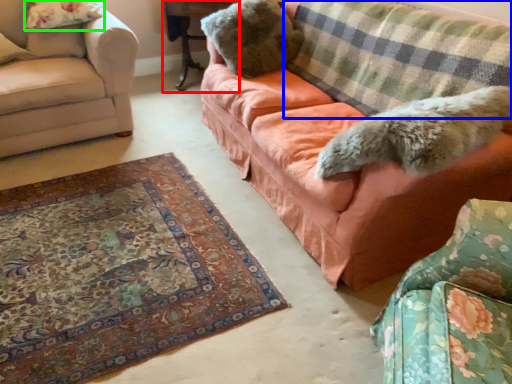
Question: Considering the real-world distances, which object is farthest from table (highlighted by a red box)? plaid (highlighted by a blue box) or pillow (highlighted by a green box)?

Choices:
 (A) plaid
 (B) pillow

Answer: (A)